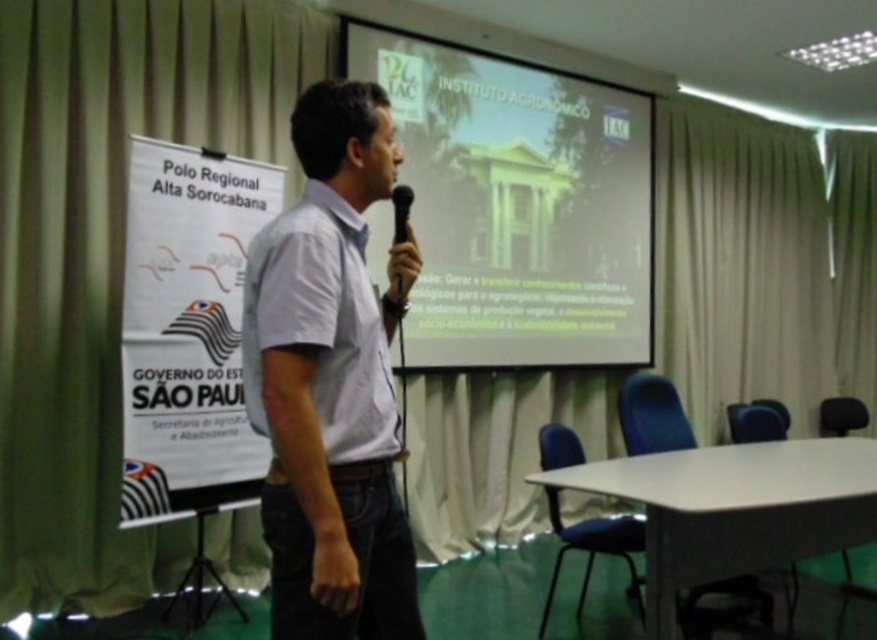
Consider the image. Which is above, white shirt at center or black plastic microphone at center?

Positioned higher is black plastic microphone at center.

Does white shirt at center have a lesser width compared to black plastic microphone at center?

In fact, white shirt at center might be wider than black plastic microphone at center.

Between point (298, 582) and point (412, 198), which one is positioned in front?

Point (298, 582)

Where is `white shirt at center`? This screenshot has height=640, width=877. white shirt at center is located at coordinates (332, 380).

Can you confirm if white glossy projector screen at upper center is taller than black plastic microphone at center?

Yes.

Between point (640, 179) and point (410, 198), which one is positioned in front?

Positioned in front is point (410, 198).

Is point (365, 24) in front of point (398, 212)?

No, it is not.

This screenshot has height=640, width=877. Identify the location of white glossy projector screen at upper center. (518, 204).

Is white matte shirt at center positioned behind black plastic microphone at center?

No, white matte shirt at center is in front of black plastic microphone at center.

Which is above, white matte shirt at center or black plastic microphone at center?

black plastic microphone at center is above.

Is point (267, 266) closer to camera compared to point (404, 202)?

That is True.

You are a GUI agent. You are given a task and a screenshot of the screen. Output one action in this format:
    pyautogui.click(x=<x>, y=<y>)
    Task: Click on the white matte shirt at center
    
    Given the screenshot: What is the action you would take?
    pyautogui.click(x=321, y=323)